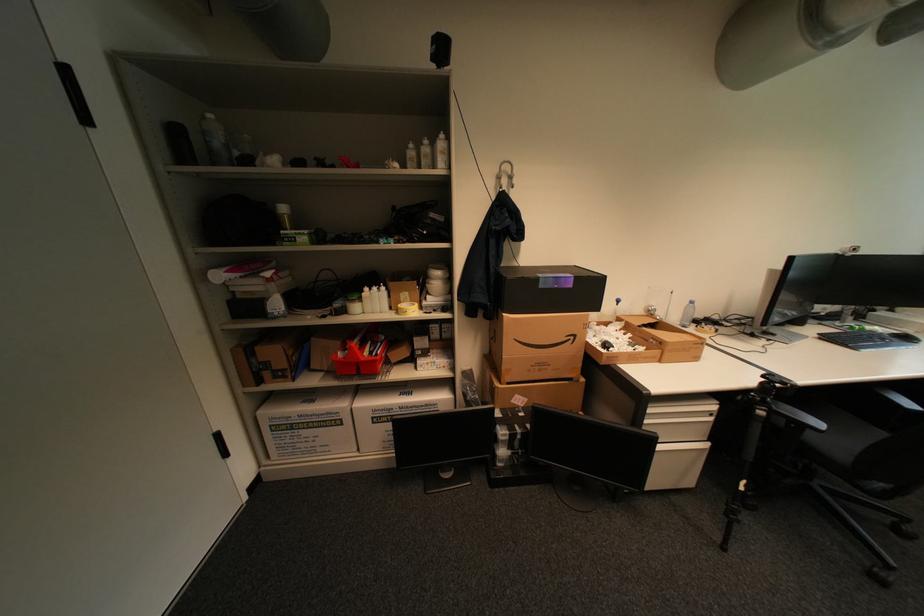
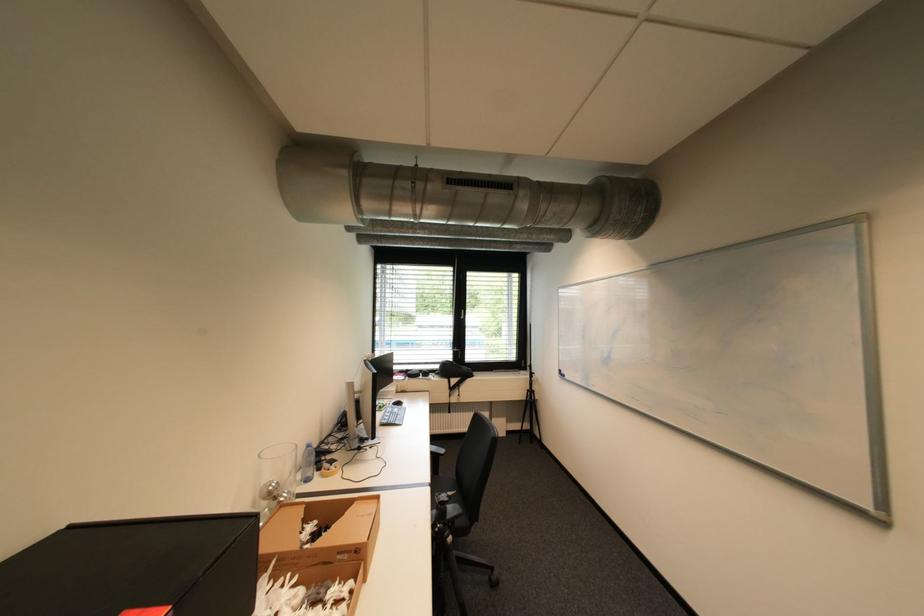
Where in the second image is the point corresponding to the point at 770,413 from the first image?

(458, 540)